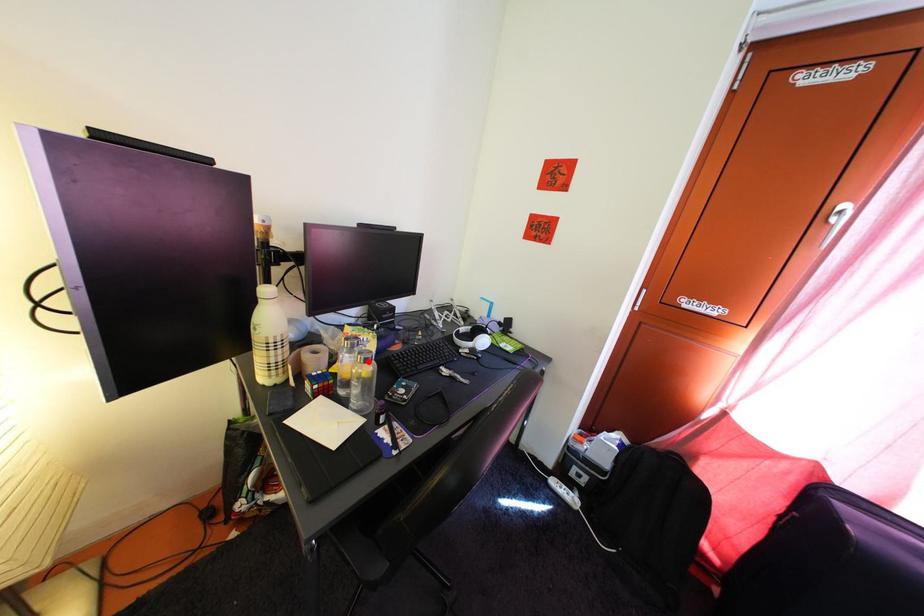
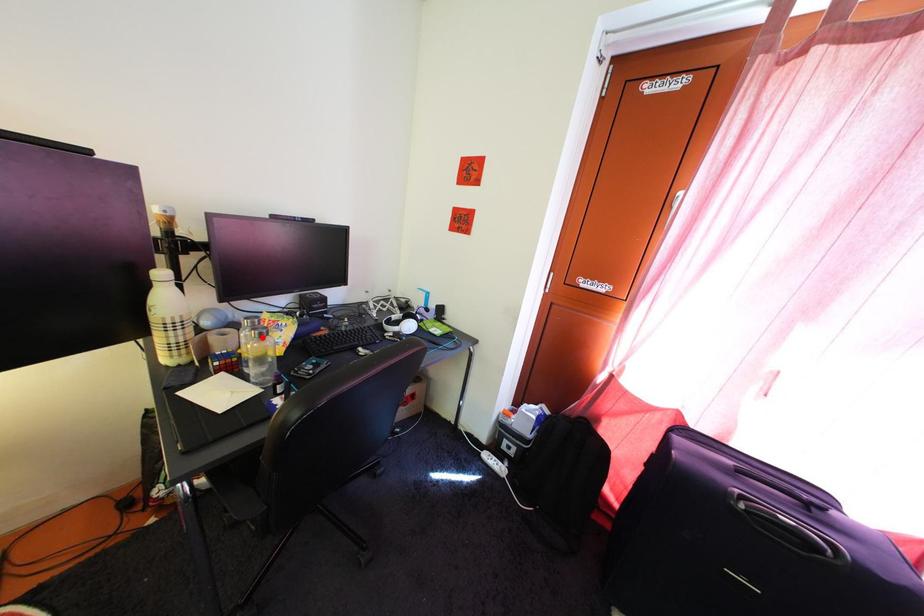
I am providing you with two images of the same scene from different viewpoints. A red point is marked on the first image and another point is marked on the second image. Is the marked point in image1 the same physical position as the marked point in image2?

Yes